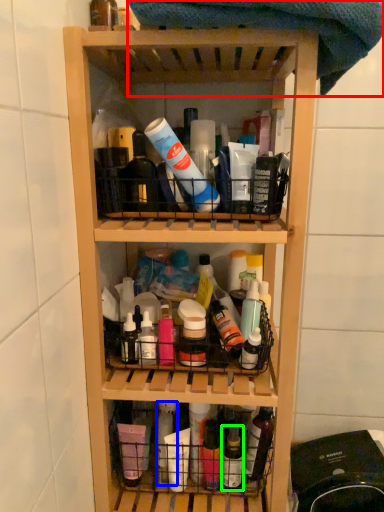
Question: Which object is positioned farthest from beach towel (highlighted by a red box)? Select from bottle (highlighted by a blue box) and bottle (highlighted by a green box).

Choices:
 (A) bottle
 (B) bottle

Answer: (B)